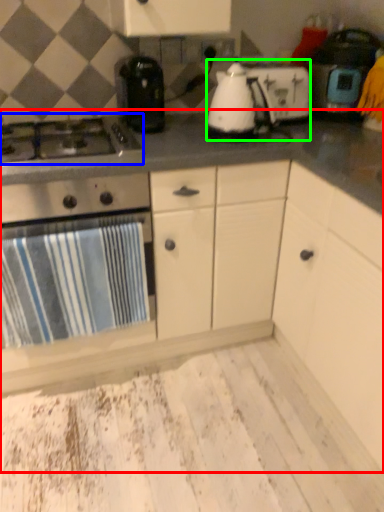
Question: Based on their relative distances, which object is nearer to countertop (highlighted by a red box)? Choose from gas stove (highlighted by a blue box) and kitchen appliance (highlighted by a green box).

Choices:
 (A) gas stove
 (B) kitchen appliance

Answer: (B)